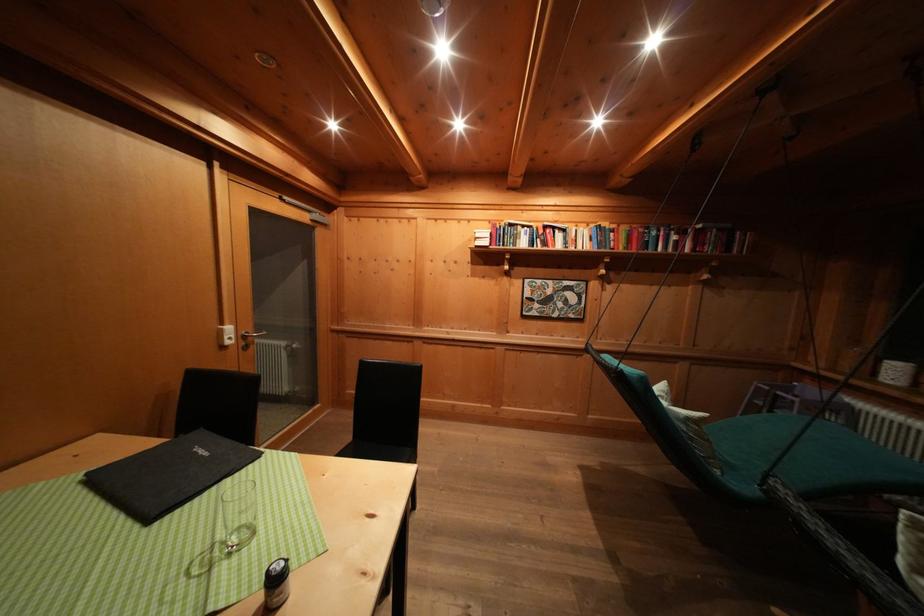
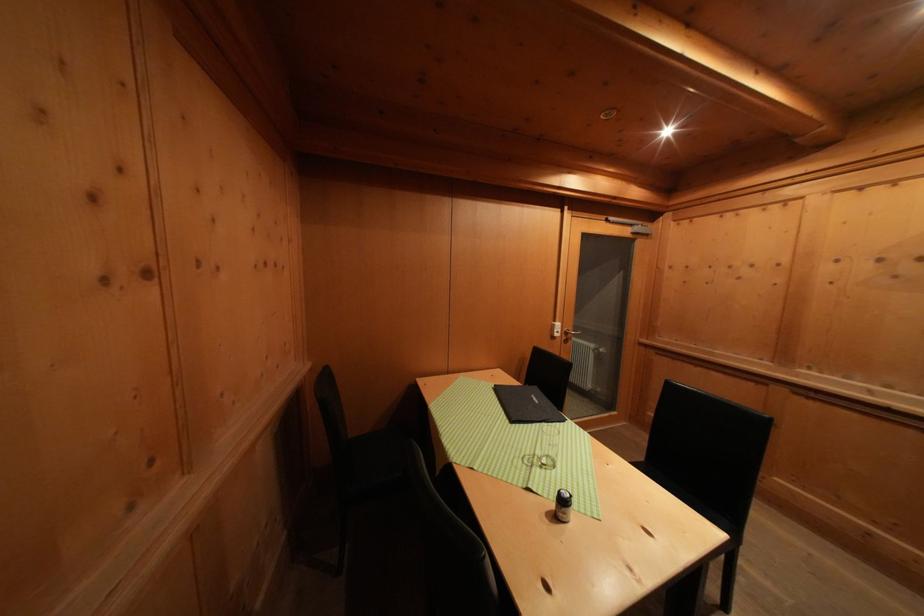
Locate, in the second image, the point that corresponds to [211,459] in the first image.

(542, 406)